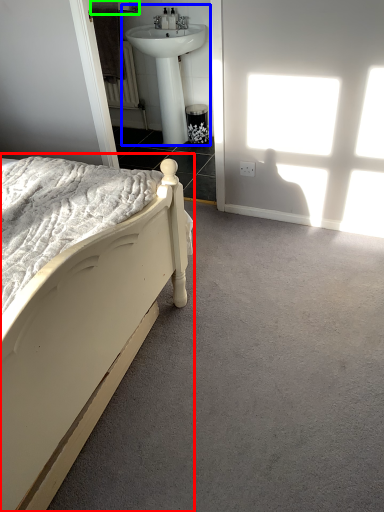
Question: Which object is positioned farthest from bed (highlighted by a red box)? Select from sink (highlighted by a blue box) and towel bar (highlighted by a green box).

Choices:
 (A) sink
 (B) towel bar

Answer: (B)